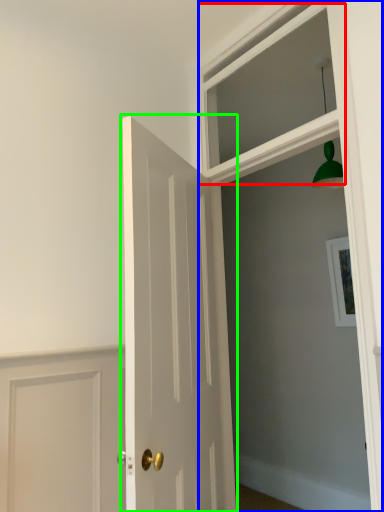
Question: Which is farther away from window (highlighted by a red box)? window frame (highlighted by a blue box) or door (highlighted by a green box)?

Choices:
 (A) window frame
 (B) door

Answer: (B)